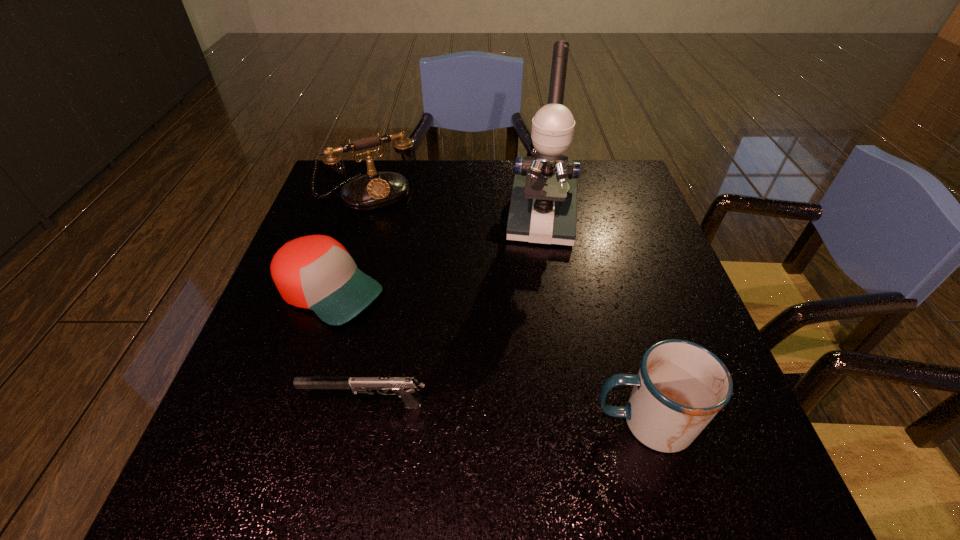
Where is `object at the near left corner`? object at the near left corner is located at coordinates (405, 387).

Image resolution: width=960 pixels, height=540 pixels. In order to click on object located at the near right corner in this screenshot , I will do `click(680, 387)`.

In the image, there is a desktop. Where is `vacant space at the far edge`? This screenshot has width=960, height=540. vacant space at the far edge is located at coordinates (446, 180).

You are a GUI agent. You are given a task and a screenshot of the screen. Output one action in this format:
    pyautogui.click(x=<x>, y=<y>)
    Task: Click on the vacant area at the left edge of the desktop
    Image resolution: width=960 pixels, height=540 pixels.
    Given the screenshot: What is the action you would take?
    pyautogui.click(x=311, y=336)

In the image, there is a desktop. Identify the location of vacant space at the right edge. [618, 267].

In the image, there is a desktop. Where is `free region at the far right corner`? The height and width of the screenshot is (540, 960). free region at the far right corner is located at coordinates (630, 176).

Locate an element on the screen. Image resolution: width=960 pixels, height=540 pixels. unoccupied position between the baseball cap and the telephone is located at coordinates (349, 242).

At what (x,y) coordinates should I click in order to perform the action: click on empty location between the gun and the second shortest object. Please return your answer as a coordinate pair (x, y). The width and height of the screenshot is (960, 540). Looking at the image, I should click on (348, 348).

This screenshot has width=960, height=540. I want to click on empty space between the gun and the tallest object, so click(x=454, y=312).

Locate an element on the screen. The image size is (960, 540). vacant area that lies between the third shortest object and the baseball cap is located at coordinates (488, 357).